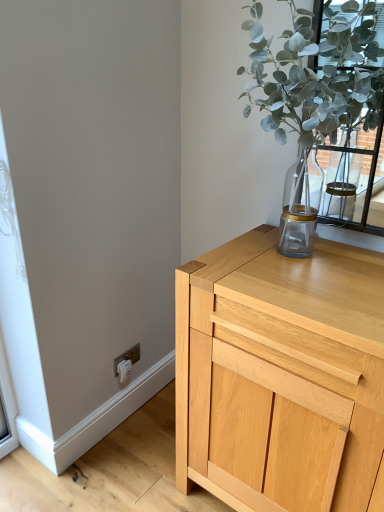
Question: From the image's perspective, is white plastic electric outlet at lower left located above or below green leafy plant at upper right?

Choices:
 (A) below
 (B) above

Answer: (A)

Question: Considering the positions of white plastic electric outlet at lower left and green leafy plant at upper right in the image, is white plastic electric outlet at lower left wider or thinner than green leafy plant at upper right?

Choices:
 (A) thin
 (B) wide

Answer: (A)

Question: Based on their relative distances, which object is farther from the white plastic electric outlet at lower left?

Choices:
 (A) green leafy plant at upper right
 (B) light wood cabinet at upper right

Answer: (A)

Question: Based on their relative distances, which object is farther from the light wood cabinet at upper right?

Choices:
 (A) white plastic electric outlet at lower left
 (B) green leafy plant at upper right

Answer: (A)